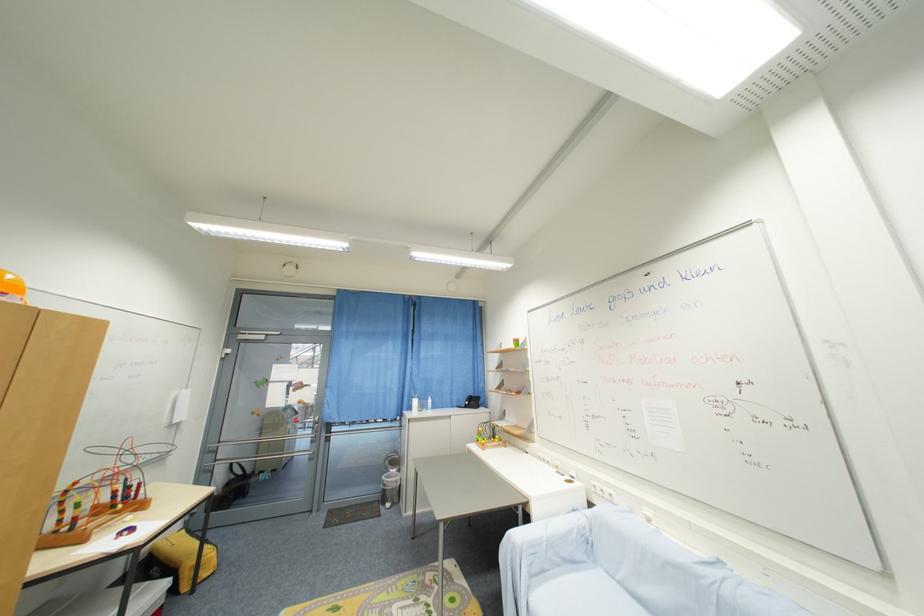
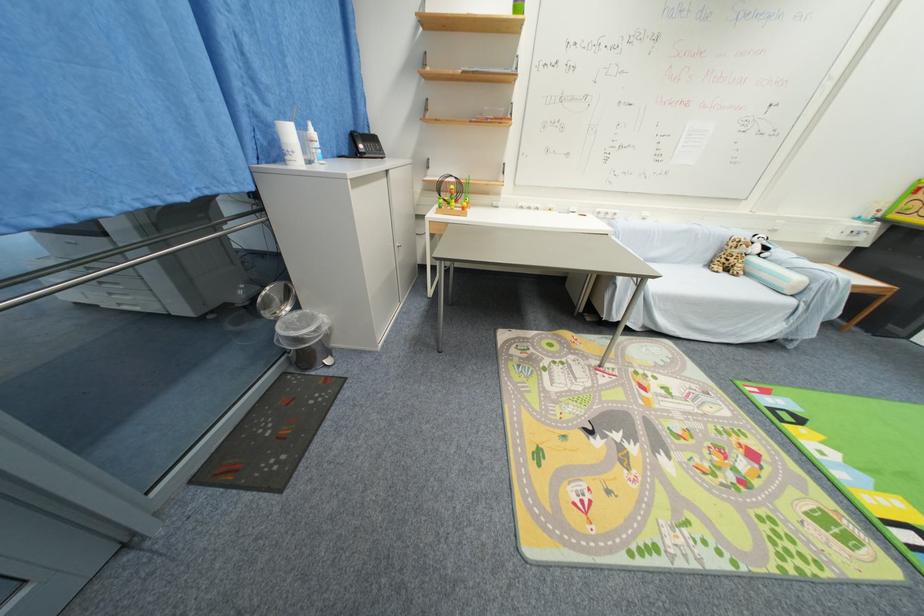
In the second image, find the point that corresponds to [405,472] in the first image.

(301, 309)